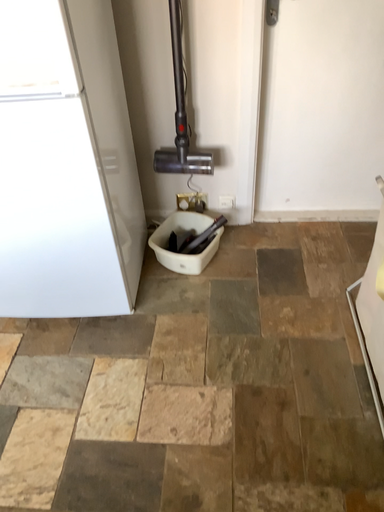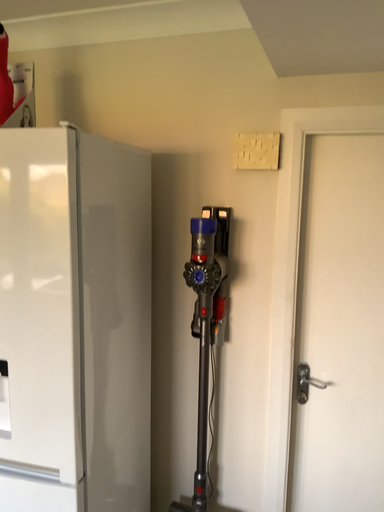
Question: How did the camera likely rotate when shooting the video?

Choices:
 (A) rotated left
 (B) rotated right

Answer: (A)